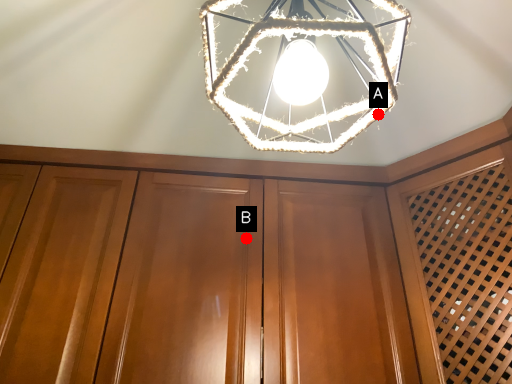
Question: Two points are circled on the image, labeled by A and B beside each circle. Which point is closer to the camera?

Choices:
 (A) A is closer
 (B) B is closer

Answer: (A)